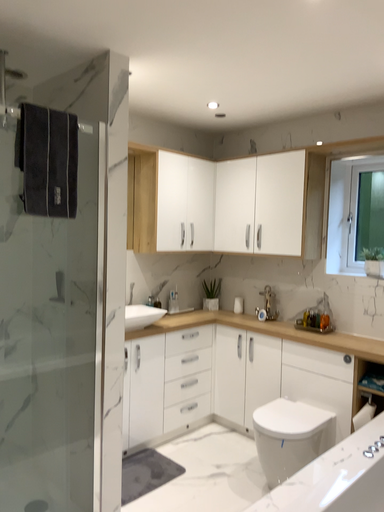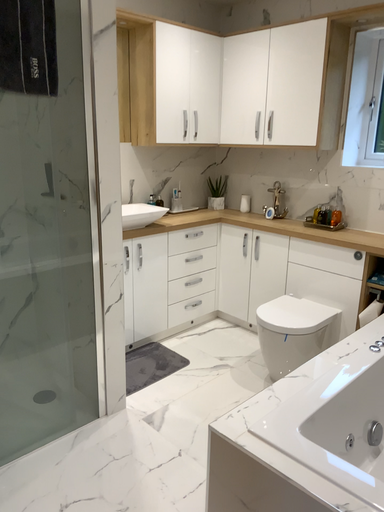
Question: How did the camera likely rotate when shooting the video?

Choices:
 (A) rotated upward
 (B) rotated downward

Answer: (B)